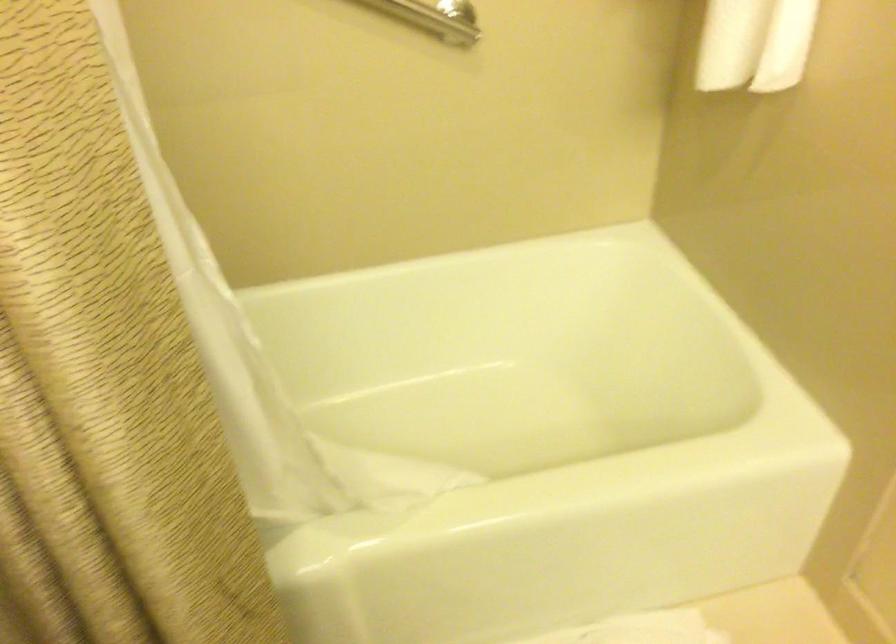
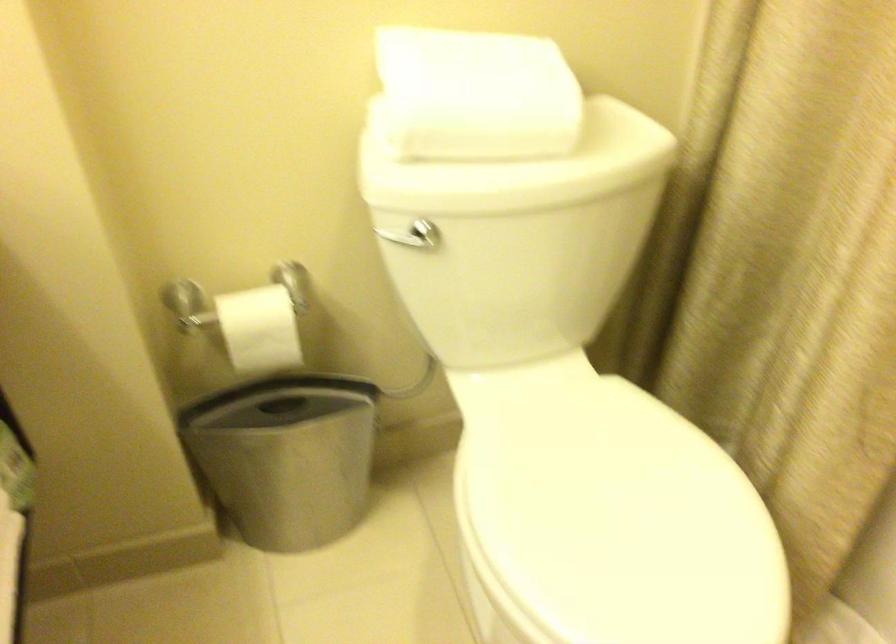
Based on the continuous images, in which direction is the camera rotating?

The rotation direction of the camera is left-down.